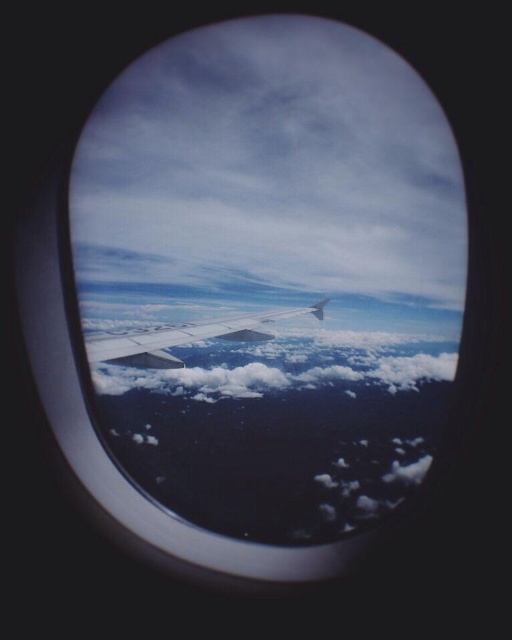
Question: Which point appears closest to the camera in this image?

Choices:
 (A) (210, 349)
 (B) (119, 336)

Answer: (B)

Question: Observing the image, what is the correct spatial positioning of white fluffy cloud at center in reference to metallic silver wing at center?

Choices:
 (A) above
 (B) below

Answer: (B)

Question: Does white fluffy cloud at center have a greater width compared to metallic silver wing at center?

Choices:
 (A) no
 (B) yes

Answer: (B)

Question: Which of the following is the farthest from the observer?

Choices:
 (A) (311, 308)
 (B) (268, 365)

Answer: (B)

Question: Observing the image, what is the correct spatial positioning of white fluffy cloud at center in reference to metallic silver wing at center?

Choices:
 (A) left
 (B) right

Answer: (A)